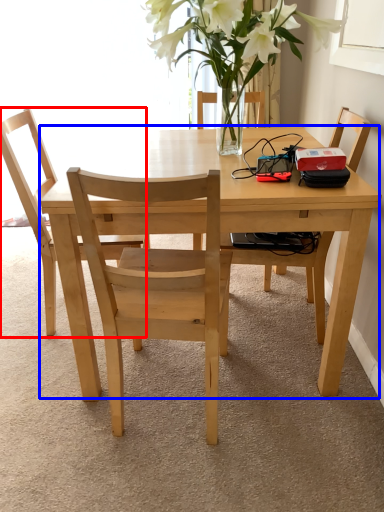
Question: Which of the following is the closest to the observer, chair (highlighted by a red box) or kitchen & dining room table (highlighted by a blue box)?

Choices:
 (A) chair
 (B) kitchen & dining room table

Answer: (B)